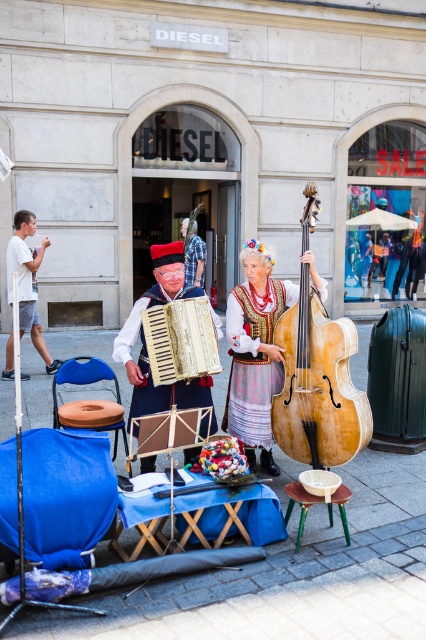
Question: From the image, what is the correct spatial relationship of matte beige accordion at center in relation to wooden textured accordion at center?

Choices:
 (A) right
 (B) left

Answer: (B)

Question: Is wooden textured accordion at center thinner than green wooden stool at lower center?

Choices:
 (A) yes
 (B) no

Answer: (B)

Question: Considering the real-world distances, which object is farthest from the white t-shirt at left?

Choices:
 (A) green wooden stool at lower center
 (B) embroidered cotton dress at center
 (C) matte beige accordion at center

Answer: (A)

Question: Which point is farther from the camera taking this photo?

Choices:
 (A) (307, 252)
 (B) (321, 406)
 (C) (11, 289)

Answer: (A)

Question: Observing the image, what is the correct spatial positioning of wooden double bass at center in reference to green wooden stool at lower center?

Choices:
 (A) above
 (B) below

Answer: (A)

Question: Which object is the closest to the white t-shirt at left?

Choices:
 (A) wooden textured accordion at center
 (B) matte beige accordion at center
 (C) green wooden stool at lower center

Answer: (B)